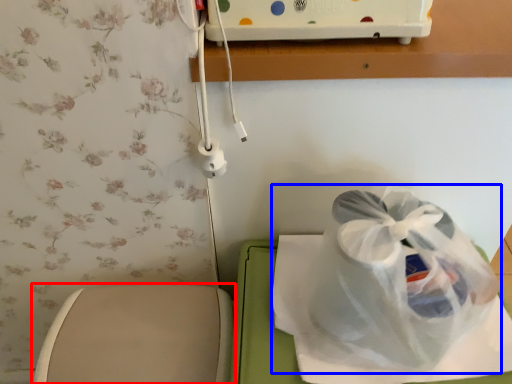
Question: Which of the following is the farthest to the observer, toilet (highlighted by a red box) or plastic bag (highlighted by a blue box)?

Choices:
 (A) toilet
 (B) plastic bag

Answer: (A)